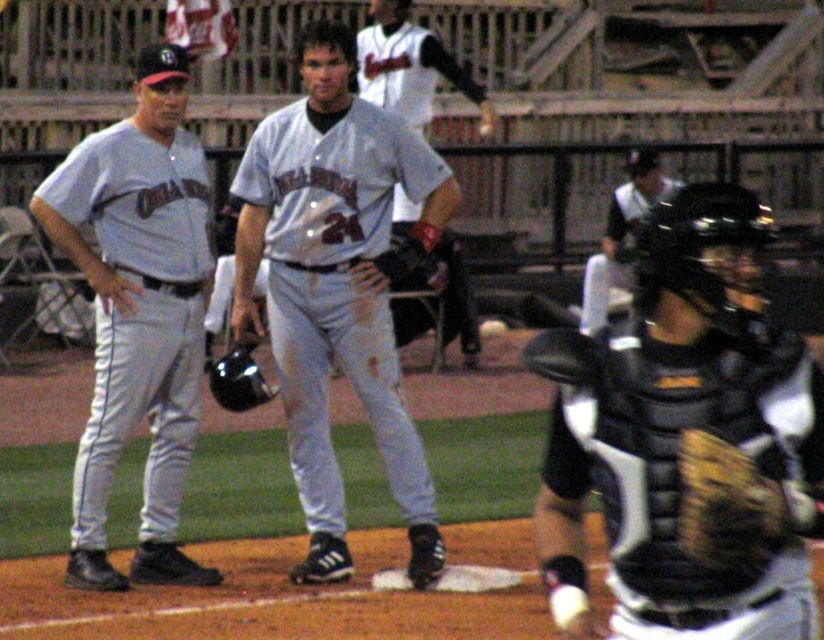
Looking at this image, you are a photographer trying to capture a photo of both the gray fabric uniform at left and the white jersey at center. Since you want them both in the frame, can you tell me which direction you should position your camera relative to the players?

The gray fabric uniform at left is positioned on the left side of white jersey at center, so you should position your camera to the right of the players to ensure both are in the frame.

You are a groundskeeper who needs to place a 5 feet long measuring tape between the white jersey at center and the white matte baseball at center. Can you fit the measuring tape between them without bending it?

The white jersey at center is 4.65 feet from the white matte baseball at center. Since the measuring tape is 5 feet long, it will be slightly too long to fit straight between them without bending.

What is the color of the fabric at the point with coordinates (138,314)?

The point at coordinates (138,314) is on the gray fabric uniform at left.